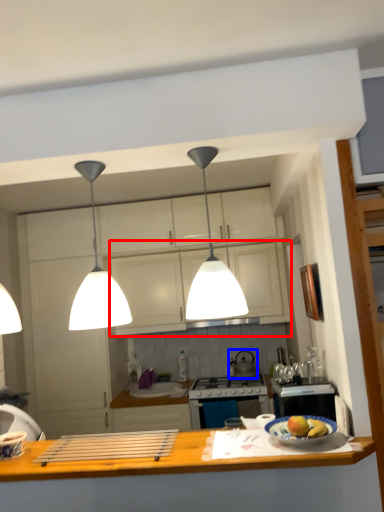
Question: Which object is closer to the camera taking this photo, cabinetry (highlighted by a red box) or kitchen appliance (highlighted by a blue box)?

Choices:
 (A) cabinetry
 (B) kitchen appliance

Answer: (A)